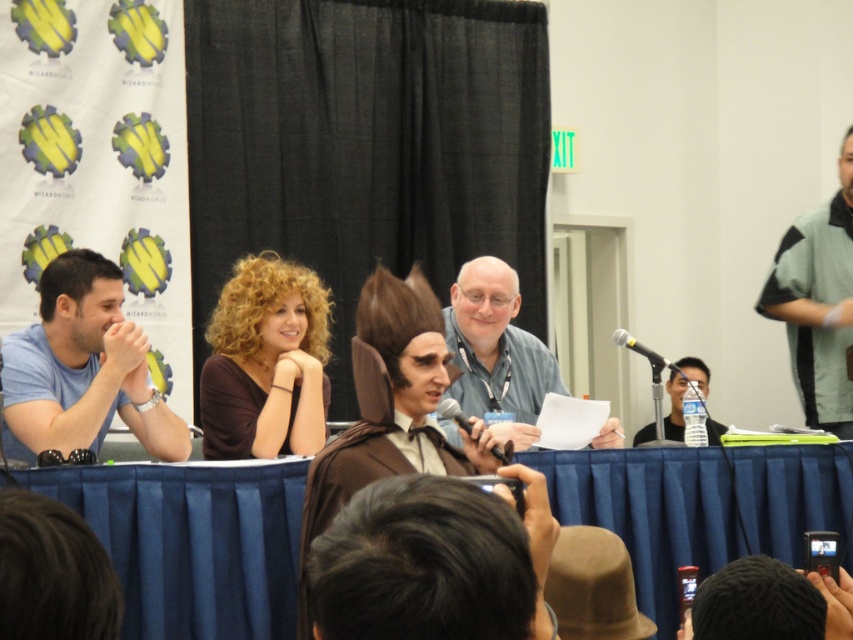
You are a photographer setting up for a panel discussion. You have a blue fabric table at center and a black matte microphone at center. Which object is taller when viewed from above?

The blue fabric table at center is taller than the black matte microphone at center.

You are a convention attendee trying to position your phone to record the panel discussion. The blue fabric table at center and the black matte microphone at center are in your view. Which object should you place on the left side of your phone frame to capture both properly?

The black matte microphone at center should be placed on the left side of your phone frame because the blue fabric table at center is positioned on the right side of the black matte microphone at center, ensuring both are captured properly.